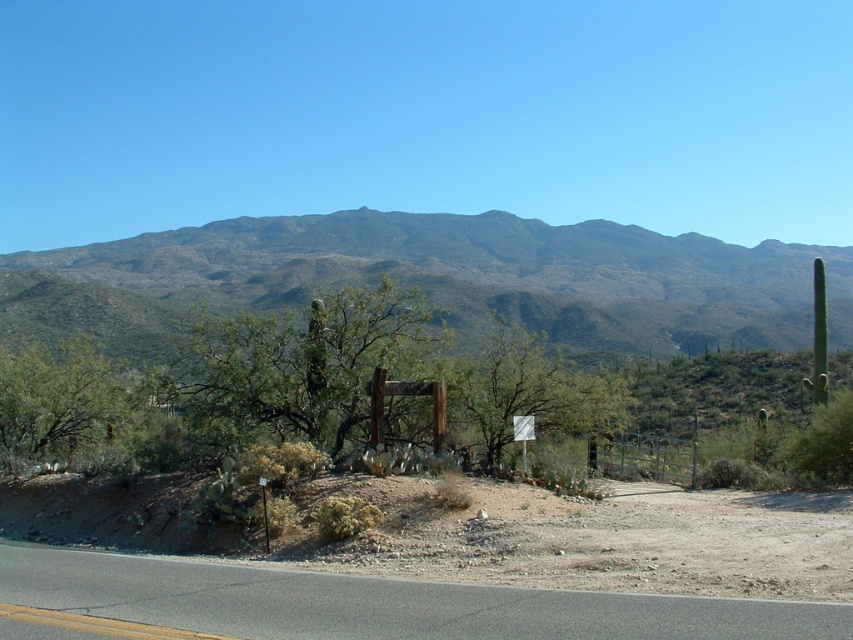
You are driving a car and see the asphalt road at lower center and the white plastic sign at center. Which object is closer to you?

The asphalt road at lower center is closer to the viewer than the white plastic sign at center.

You are a photographer trying to capture the desert landscape. You notice two points marked in the image. Which point, point (181, 588) or point (518, 429), is closer to your camera lens?

Point (181, 588) is closer to the camera than point (518, 429).